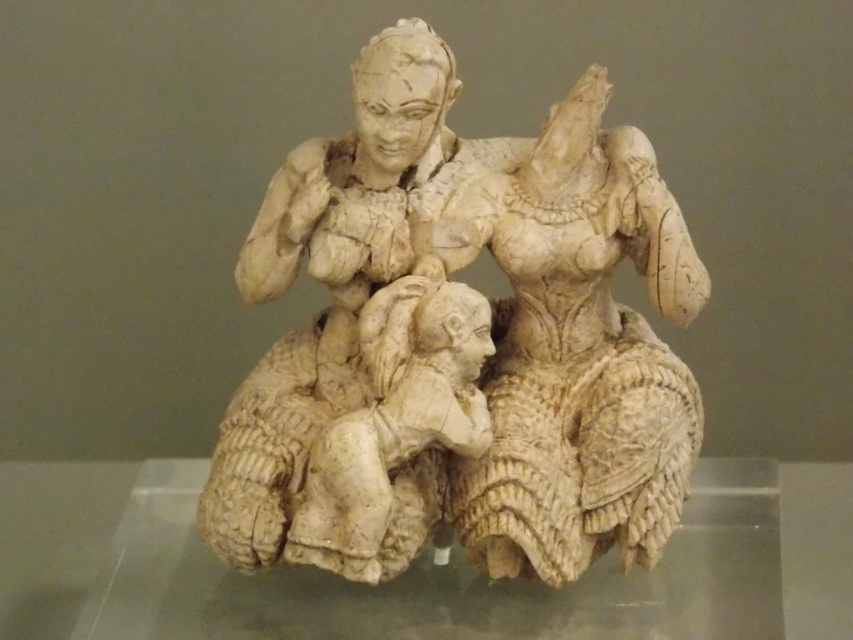
Question: Estimate the real-world distances between objects in this image. Which object is closer to the ivory sculpture at center?

Choices:
 (A) transparent glass table at center
 (B) matte beige figure at center

Answer: (B)

Question: Is matte beige figure at center above transparent glass table at center?

Choices:
 (A) no
 (B) yes

Answer: (B)

Question: Is ivory sculpture at center positioned in front of matte beige figure at center?

Choices:
 (A) yes
 (B) no

Answer: (B)

Question: Considering the real-world distances, which object is closest to the transparent glass table at center?

Choices:
 (A) ivory sculpture at center
 (B) matte beige figure at center

Answer: (B)

Question: Which object is the closest to the matte beige figure at center?

Choices:
 (A) ivory sculpture at center
 (B) transparent glass table at center

Answer: (A)

Question: Is ivory sculpture at center further to the viewer compared to transparent glass table at center?

Choices:
 (A) yes
 (B) no

Answer: (B)